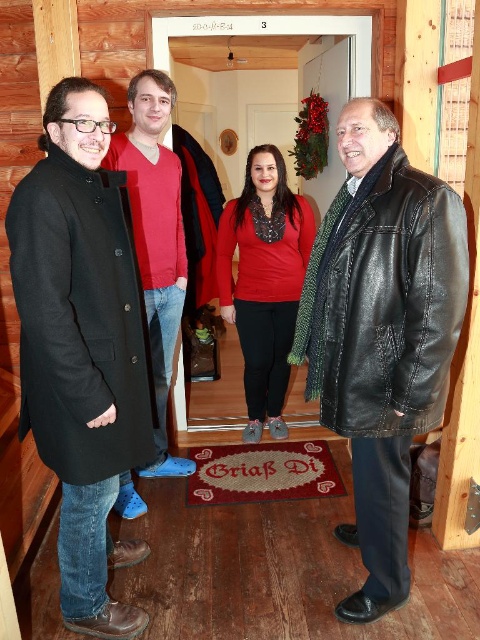
Is matte black coat at left positioned at the back of black leather coat at right?

No, it is not.

Does point (101, 172) come in front of point (375, 243)?

That is False.

This screenshot has width=480, height=640. I want to click on matte black coat at left, so click(82, 348).

Measure the distance from black leather coat at right to matte red sweater at center.

A distance of 3.46 feet exists between black leather coat at right and matte red sweater at center.

This screenshot has height=640, width=480. Describe the element at coordinates (382, 333) in the screenshot. I see `black leather coat at right` at that location.

Describe the element at coordinates (382, 333) in the screenshot. I see `black leather coat at right` at that location.

Find the location of a particular element. The image size is (480, 640). black leather coat at right is located at coordinates (382, 333).

Is point (403, 544) farther from camera compared to point (130, 193)?

No, (403, 544) is in front of (130, 193).

Does black leather coat at right appear on the left side of matte red sweater at left?

Incorrect, black leather coat at right is not on the left side of matte red sweater at left.

What do you see at coordinates (382, 333) in the screenshot?
I see `black leather coat at right` at bounding box center [382, 333].

Identify the location of black leather coat at right. The width and height of the screenshot is (480, 640). (382, 333).